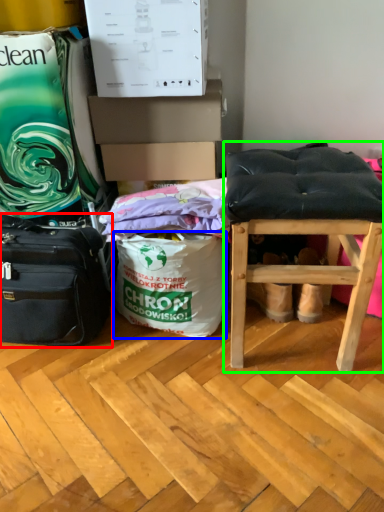
Question: Considering the real-world distances, which object is farthest from luggage and bags (highlighted by a red box)? shopping bag (highlighted by a blue box) or stool (highlighted by a green box)?

Choices:
 (A) shopping bag
 (B) stool

Answer: (B)